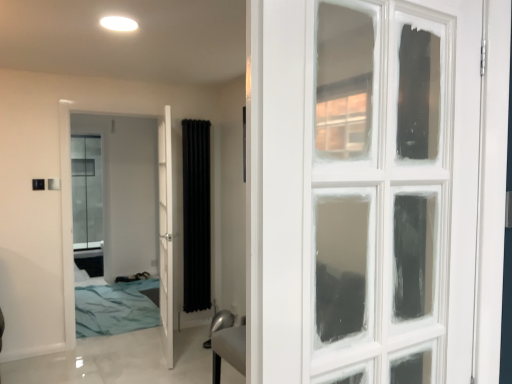
Question: Is white glossy door at center, which ranks as the 1th door in right-to-left order, thinner than white glossy door at center, acting as the second door starting from the right?

Choices:
 (A) no
 (B) yes

Answer: (A)

Question: Does white glossy door at center, which appears as the 2th door when viewed from the left, appear on the left side of white glossy door at center, acting as the second door starting from the right?

Choices:
 (A) yes
 (B) no

Answer: (B)

Question: Is white glossy door at center, which ranks as the 1th door in right-to-left order, positioned behind white glossy door at center, acting as the second door starting from the right?

Choices:
 (A) no
 (B) yes

Answer: (A)

Question: Is white glossy door at center, which appears as the 2th door when viewed from the left, completely or partially outside of white glossy door at center, the first door when ordered from left to right?

Choices:
 (A) yes
 (B) no

Answer: (A)

Question: Is white glossy door at center, which appears as the 2th door when viewed from the left, oriented away from white glossy door at center, acting as the second door starting from the right?

Choices:
 (A) yes
 (B) no

Answer: (B)

Question: Considering their positions, is white glossy door at center, acting as the second door starting from the right, located in front of or behind black fabric radiator at center?

Choices:
 (A) behind
 (B) front

Answer: (B)

Question: Considering the relative positions of white glossy door at center, acting as the second door starting from the right, and black fabric radiator at center in the image provided, is white glossy door at center, acting as the second door starting from the right, to the left or to the right of black fabric radiator at center?

Choices:
 (A) right
 (B) left

Answer: (B)

Question: Is white glossy door at center, the first door when ordered from left to right, wider or thinner than black fabric radiator at center?

Choices:
 (A) wide
 (B) thin

Answer: (B)

Question: Is white glossy door at center, acting as the second door starting from the right, inside the boundaries of black fabric radiator at center, or outside?

Choices:
 (A) inside
 (B) outside

Answer: (B)

Question: Based on their positions, is white glossy door at center, which ranks as the 1th door in right-to-left order, located to the left or right of black fabric radiator at center?

Choices:
 (A) left
 (B) right

Answer: (A)

Question: Is white glossy door at center, which ranks as the 1th door in right-to-left order, wider or thinner than black fabric radiator at center?

Choices:
 (A) wide
 (B) thin

Answer: (A)

Question: From their relative heights in the image, would you say white glossy door at center, which appears as the 2th door when viewed from the left, is taller or shorter than black fabric radiator at center?

Choices:
 (A) short
 (B) tall

Answer: (B)

Question: Do you think white glossy door at center, which ranks as the 1th door in right-to-left order, is within black fabric radiator at center, or outside of it?

Choices:
 (A) outside
 (B) inside

Answer: (A)

Question: In the image, is white glossy door at center, which appears as the 2th door when viewed from the left, positioned in front of or behind white glossy door at center, the first door when ordered from left to right?

Choices:
 (A) behind
 (B) front

Answer: (B)

Question: From the image's perspective, is white glossy door at center, which appears as the 2th door when viewed from the left, positioned above or below white glossy door at center, the first door when ordered from left to right?

Choices:
 (A) above
 (B) below

Answer: (B)